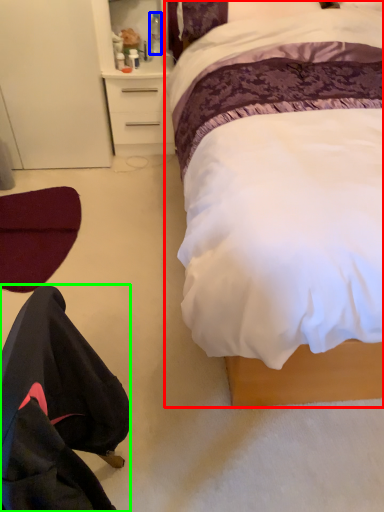
Question: Estimate the real-world distances between objects in this image. Which object is farther from bed (highlighted by a red box), bottle (highlighted by a blue box) or robe (highlighted by a green box)?

Choices:
 (A) bottle
 (B) robe

Answer: (A)